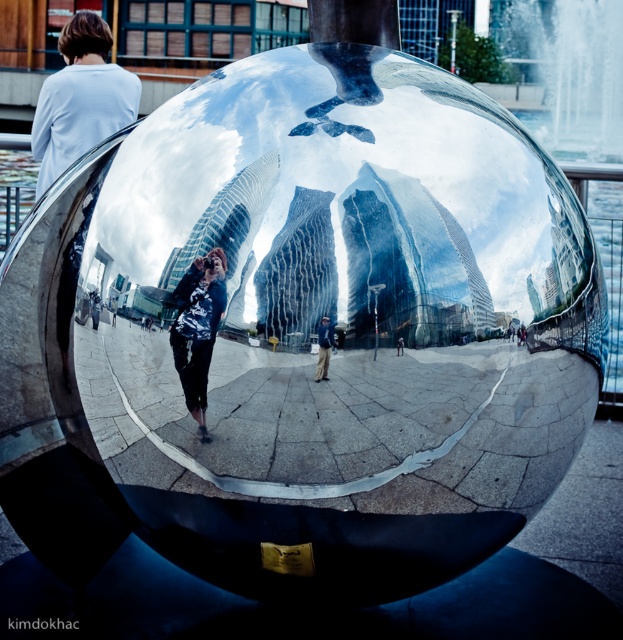
Can you confirm if matte black jacket at center is positioned to the right of light brown leather jacket at center?

In fact, matte black jacket at center is to the left of light brown leather jacket at center.

Is point (191, 356) positioned after point (325, 337)?

Yes, it is behind point (325, 337).

The height and width of the screenshot is (640, 623). I want to click on matte black jacket at center, so click(x=197, y=328).